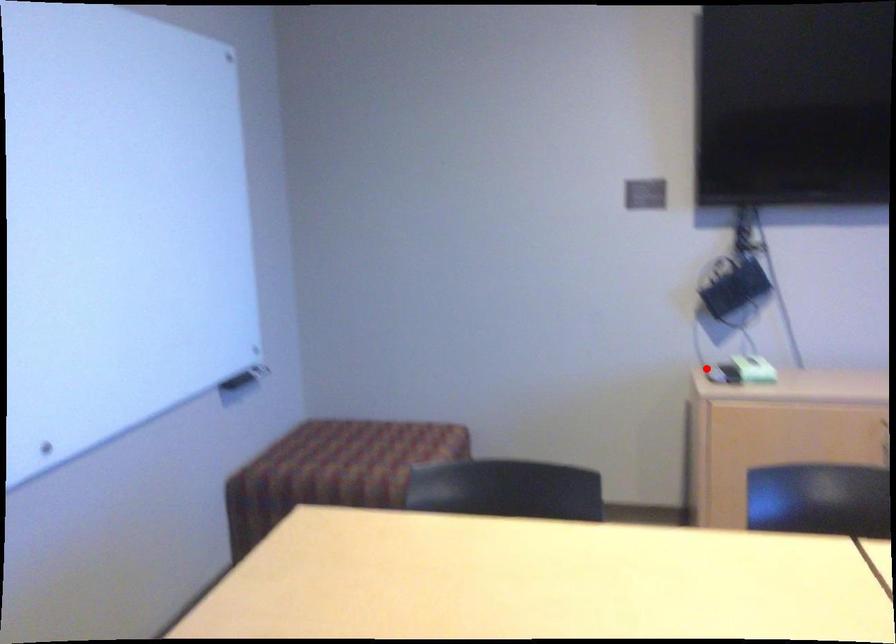
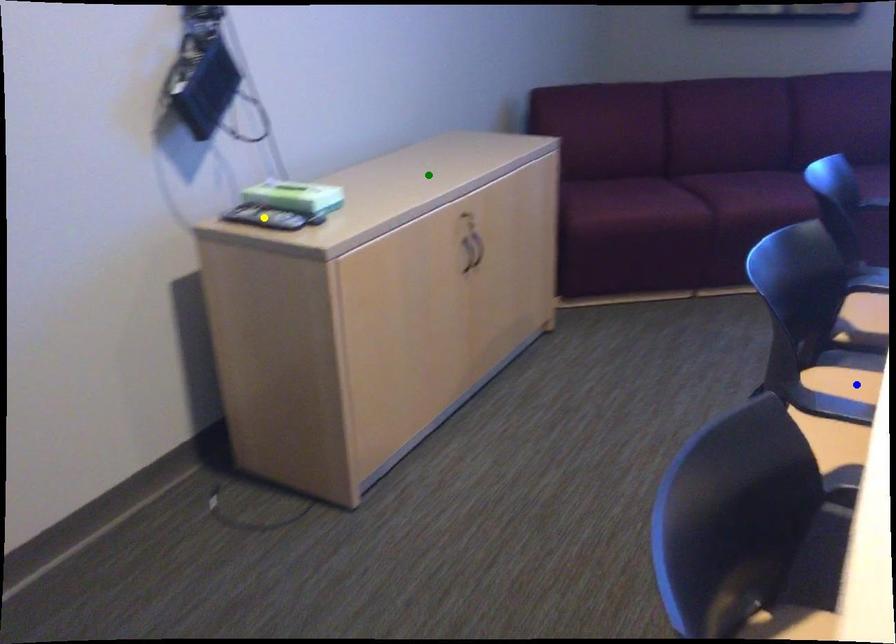
Question: I am providing you with two images of the same scene from different viewpoints. A red point is marked on the first image. You are given multiple points on the second image. Which mark in image 2 goes with the point in image 1?

Choices:
 (A) blue point
 (B) yellow point
 (C) green point

Answer: (B)